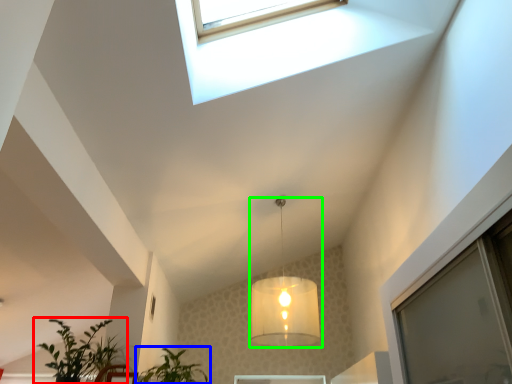
Question: Which is farther away from houseplant (highlighted by a red box)? houseplant (highlighted by a blue box) or lamp (highlighted by a green box)?

Choices:
 (A) houseplant
 (B) lamp

Answer: (B)